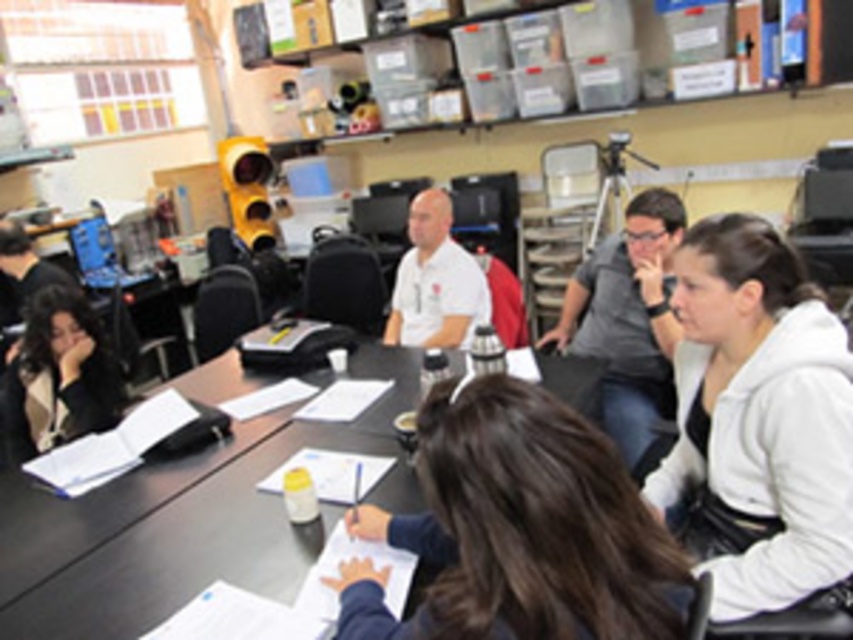
Does white matte jacket at lower right have a greater height compared to dark brown hair at center?

Correct, white matte jacket at lower right is much taller as dark brown hair at center.

Between point (805, 376) and point (659, 636), which one is positioned in front?

Point (659, 636) is in front.

Where is `white matte jacket at lower right`? This screenshot has width=853, height=640. white matte jacket at lower right is located at coordinates (759, 420).

Is dark brown hair at center wider than beige textured jacket at lower left?

Correct, the width of dark brown hair at center exceeds that of beige textured jacket at lower left.

In the scene shown: Is dark brown hair at center bigger than beige textured jacket at lower left?

Yes.

Between point (553, 476) and point (94, 371), which one is positioned behind?

The point (94, 371) is more distant.

At what (x,y) coordinates should I click in order to perform the action: click on dark brown hair at center. Please return your answer as a coordinate pair (x, y). This screenshot has width=853, height=640. Looking at the image, I should click on (517, 529).

Between white matte jacket at lower right and black plastic table at center, which one appears on the right side from the viewer's perspective?

From the viewer's perspective, white matte jacket at lower right appears more on the right side.

Does white matte jacket at lower right appear over black plastic table at center?

Indeed, white matte jacket at lower right is positioned over black plastic table at center.

Between point (718, 412) and point (267, 472), which one is positioned in front?

Point (718, 412) is in front.

This screenshot has width=853, height=640. Identify the location of white matte jacket at lower right. (759, 420).